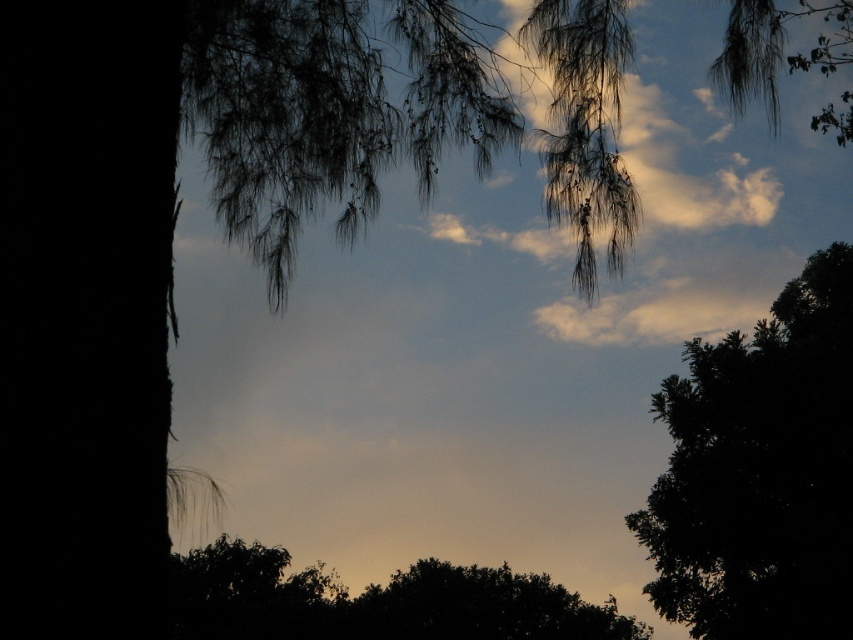
Question: Can you confirm if dark green leafy tree at right is bigger than dark green leafy tree at center?

Choices:
 (A) yes
 (B) no

Answer: (A)

Question: Among these points, which one is farthest from the camera?

Choices:
 (A) 450,632
 (B) 717,557

Answer: (A)

Question: Which point is closer to the camera?

Choices:
 (A) dark green leafy tree at right
 (B) dark green leafy tree at center

Answer: (A)

Question: Does dark green leafy tree at right appear over dark green leafy tree at center?

Choices:
 (A) yes
 (B) no

Answer: (A)

Question: Can you confirm if dark green leafy tree at right is positioned to the left of dark green leafy tree at center?

Choices:
 (A) yes
 (B) no

Answer: (B)

Question: Which object is farther from the camera taking this photo?

Choices:
 (A) dark green leafy tree at right
 (B) dark green leafy tree at center

Answer: (B)